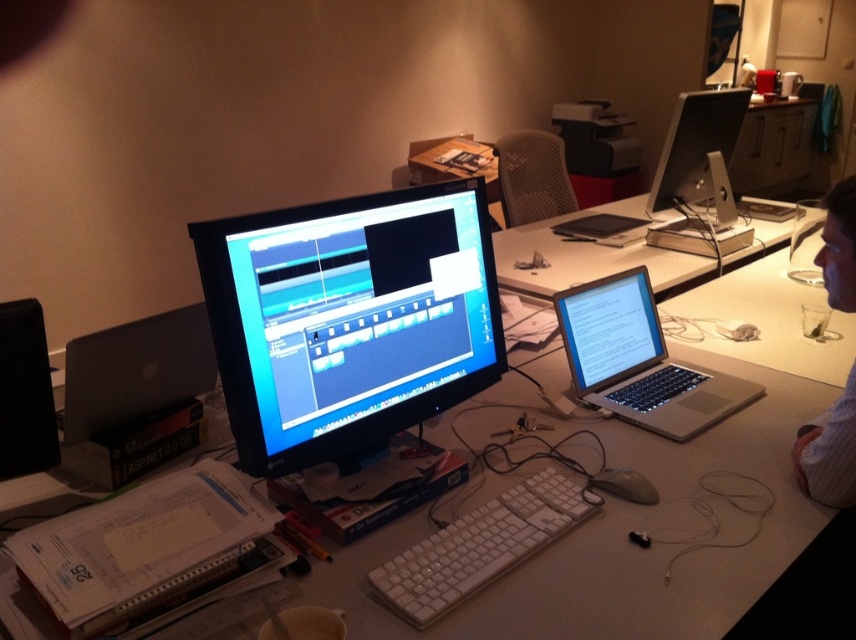
You are organizing your desk and need to move the white plastic mouse at lower center closer to you. The silver metallic laptop at center is currently in your way. Can you move the mouse without moving the laptop?

The white plastic mouse at lower center is behind the silver metallic laptop at center, so you can move it closer to you without needing to move the laptop since it is already positioned behind the laptop.

Where is the silver metallic laptop at center located in the image?

The silver metallic laptop at center is located at point (638, 360).